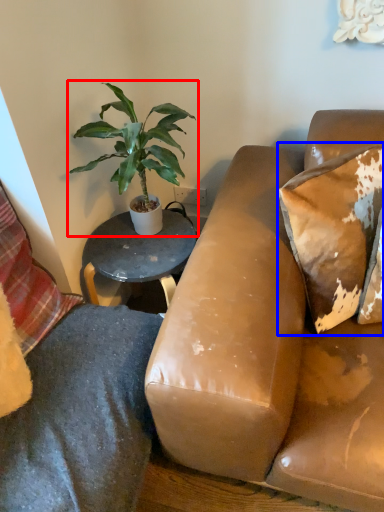
Question: Which point is further to the camera, houseplant (highlighted by a red box) or pillow (highlighted by a blue box)?

Choices:
 (A) houseplant
 (B) pillow

Answer: (A)